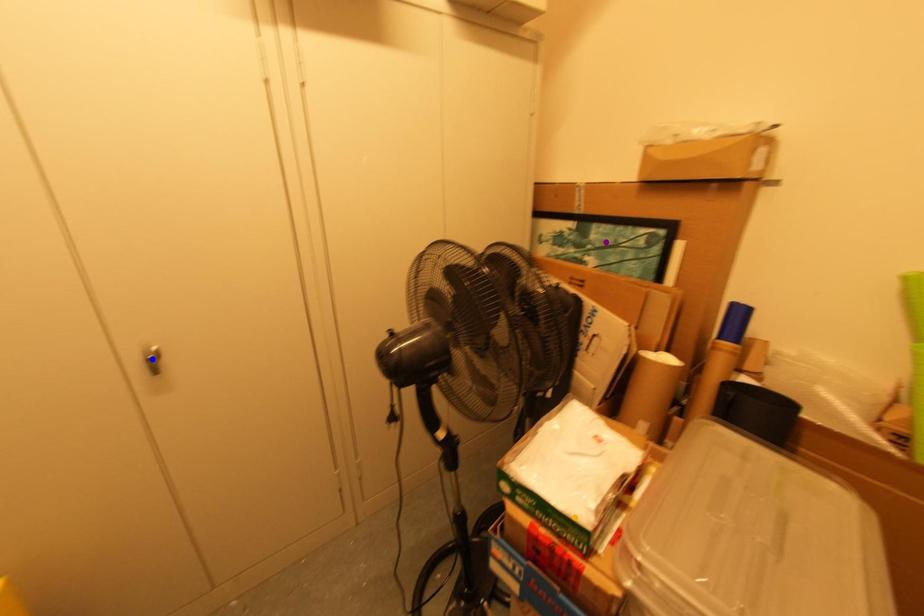
Order these from nearest to farthest:
1. blue point
2. orange point
3. purple point

orange point, blue point, purple point